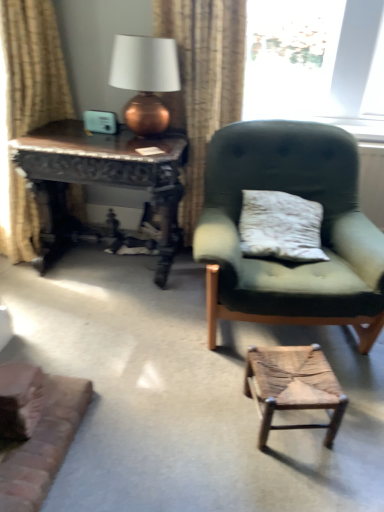
What is the approximate width of green fabric chair at center?

33.68 inches.

Find the location of `beige textured curtain at upper center, acting as the first curtain starting from the right`. beige textured curtain at upper center, acting as the first curtain starting from the right is located at coordinates (203, 81).

This screenshot has height=512, width=384. What do you see at coordinates (145, 79) in the screenshot?
I see `copper metallic table lamp at upper left` at bounding box center [145, 79].

The image size is (384, 512). Describe the element at coordinates (33, 66) in the screenshot. I see `beige fabric curtain at left, the first curtain when ordered from left to right` at that location.

This screenshot has width=384, height=512. What do you see at coordinates (293, 386) in the screenshot? I see `rustic wood stool at lower center` at bounding box center [293, 386].

Where is `green fabric chair at center`? The height and width of the screenshot is (512, 384). green fabric chair at center is located at coordinates coord(321,230).

Can you confirm if rustic wood stool at lower center is shorter than beige fabric curtain at left, positioned as the 2th curtain in right-to-left order?

Yes, rustic wood stool at lower center is shorter than beige fabric curtain at left, positioned as the 2th curtain in right-to-left order.

Are rustic wood stool at lower center and beige fabric curtain at left, the first curtain when ordered from left to right, far apart?

Yes, rustic wood stool at lower center is far from beige fabric curtain at left, the first curtain when ordered from left to right.

Which object is closer to the camera taking this photo, rustic wood stool at lower center or beige fabric curtain at left, the first curtain when ordered from left to right?

rustic wood stool at lower center is more forward.

From the picture: Who is smaller, rustic wood stool at lower center or beige fabric curtain at left, the first curtain when ordered from left to right?

rustic wood stool at lower center is smaller.

Which point is more distant from viewer, (190, 150) or (154, 41)?

The point (190, 150) is farther.

Is beige textured curtain at upper center, which is the 2th curtain from left to right, bigger or smaller than copper metallic table lamp at upper left?

Clearly, beige textured curtain at upper center, which is the 2th curtain from left to right, is larger in size than copper metallic table lamp at upper left.

Does beige textured curtain at upper center, which is the 2th curtain from left to right, have a lesser width compared to copper metallic table lamp at upper left?

Indeed, beige textured curtain at upper center, which is the 2th curtain from left to right, has a lesser width compared to copper metallic table lamp at upper left.

From the image's perspective, is beige textured curtain at upper center, which is the 2th curtain from left to right, on top of copper metallic table lamp at upper left?

Incorrect, from the image's perspective, beige textured curtain at upper center, which is the 2th curtain from left to right, is lower than copper metallic table lamp at upper left.

Looking at this image, between green fabric chair at center and wooden carved table at left, which one is positioned in front?

green fabric chair at center is closer to the camera.

Which point is more forward, (294, 148) or (77, 157)?

The point (77, 157) is in front.

Is green fabric chair at center oriented towards wooden carved table at left?

No, green fabric chair at center is not facing towards wooden carved table at left.

Would you consider green fabric chair at center to be distant from wooden carved table at left?

That's not correct — green fabric chair at center is a little close to wooden carved table at left.

How different are the orientations of beige fabric curtain at left, positioned as the 2th curtain in right-to-left order, and rustic wood stool at lower center in degrees?

There is a 76.6-degree angle between the facing directions of beige fabric curtain at left, positioned as the 2th curtain in right-to-left order, and rustic wood stool at lower center.

From the picture: Is beige fabric curtain at left, positioned as the 2th curtain in right-to-left order, at the right side of rustic wood stool at lower center?

No.

Considering their positions, is beige fabric curtain at left, positioned as the 2th curtain in right-to-left order, located in front of or behind rustic wood stool at lower center?

Visually, beige fabric curtain at left, positioned as the 2th curtain in right-to-left order, is located behind rustic wood stool at lower center.

Which point is more distant from viewer, (17, 219) or (318, 424)?

Positioned behind is point (17, 219).

Which is more to the right, copper metallic table lamp at upper left or green fabric chair at center?

From the viewer's perspective, green fabric chair at center appears more on the right side.

Is copper metallic table lamp at upper left beside green fabric chair at center?

No, copper metallic table lamp at upper left is not beside green fabric chair at center.

Who is more distant, copper metallic table lamp at upper left or green fabric chair at center?

copper metallic table lamp at upper left.

From a real-world perspective, is copper metallic table lamp at upper left above or below green fabric chair at center?

Clearly, from a real-world perspective, copper metallic table lamp at upper left is above green fabric chair at center.

Does rustic wood stool at lower center have a lesser width compared to wooden carved table at left?

Correct, the width of rustic wood stool at lower center is less than that of wooden carved table at left.

In terms of height, does rustic wood stool at lower center look taller or shorter compared to wooden carved table at left?

Clearly, rustic wood stool at lower center is shorter compared to wooden carved table at left.

From a real-world perspective, is rustic wood stool at lower center physically above wooden carved table at left?

No, from a real-world perspective, rustic wood stool at lower center is not above wooden carved table at left.

Does rustic wood stool at lower center contain wooden carved table at left?

No, wooden carved table at left is located outside of rustic wood stool at lower center.

Is beige fabric curtain at left, the first curtain when ordered from left to right, next to beige textured curtain at upper center, acting as the first curtain starting from the right?

No, beige fabric curtain at left, the first curtain when ordered from left to right, is not touching beige textured curtain at upper center, acting as the first curtain starting from the right.

Could you tell me if beige fabric curtain at left, positioned as the 2th curtain in right-to-left order, is facing beige textured curtain at upper center, which is the 2th curtain from left to right?

Yes, beige fabric curtain at left, positioned as the 2th curtain in right-to-left order, is facing beige textured curtain at upper center, which is the 2th curtain from left to right.

Between beige fabric curtain at left, the first curtain when ordered from left to right, and beige textured curtain at upper center, which is the 2th curtain from left to right, which one has larger size?

beige fabric curtain at left, the first curtain when ordered from left to right.

Find the location of a particular element. The width and height of the screenshot is (384, 512). curtain behind the beige fabric curtain at left, the first curtain when ordered from left to right is located at coordinates (203, 81).

Find the location of a particular element. The height and width of the screenshot is (512, 384). stool that appears on the right of beige fabric curtain at left, positioned as the 2th curtain in right-to-left order is located at coordinates (293, 386).

Where is `curtain behind the copper metallic table lamp at upper left`? curtain behind the copper metallic table lamp at upper left is located at coordinates (203, 81).

From the image, which object appears to be farther from beige textured curtain at upper center, which is the 2th curtain from left to right, wooden carved table at left or beige fabric curtain at left, the first curtain when ordered from left to right?

beige fabric curtain at left, the first curtain when ordered from left to right, is further to beige textured curtain at upper center, which is the 2th curtain from left to right.

When comparing their distances from beige textured curtain at upper center, acting as the first curtain starting from the right, does rustic wood stool at lower center or copper metallic table lamp at upper left seem further?

Based on the image, rustic wood stool at lower center appears to be further to beige textured curtain at upper center, acting as the first curtain starting from the right.

Considering their positions, is beige textured curtain at upper center, acting as the first curtain starting from the right, positioned closer to wooden carved table at left than beige fabric curtain at left, positioned as the 2th curtain in right-to-left order?

beige fabric curtain at left, positioned as the 2th curtain in right-to-left order, is positioned closer to the anchor wooden carved table at left.

Considering their positions, is wooden carved table at left positioned closer to beige textured curtain at upper center, which is the 2th curtain from left to right, than green fabric chair at center?

wooden carved table at left.

Considering their positions, is beige textured curtain at upper center, which is the 2th curtain from left to right, positioned further to copper metallic table lamp at upper left than wooden carved table at left?

wooden carved table at left is further to copper metallic table lamp at upper left.

Based on their spatial positions, is beige fabric curtain at left, the first curtain when ordered from left to right, or wooden carved table at left further from green fabric chair at center?

Based on the image, beige fabric curtain at left, the first curtain when ordered from left to right, appears to be further to green fabric chair at center.

When comparing their distances from beige fabric curtain at left, the first curtain when ordered from left to right, does beige textured curtain at upper center, acting as the first curtain starting from the right, or green fabric chair at center seem closer?

beige textured curtain at upper center, acting as the first curtain starting from the right, lies closer to beige fabric curtain at left, the first curtain when ordered from left to right, than the other object.

Looking at this image, considering their positions, is rustic wood stool at lower center positioned further to beige fabric curtain at left, positioned as the 2th curtain in right-to-left order, than copper metallic table lamp at upper left?

The object further to beige fabric curtain at left, positioned as the 2th curtain in right-to-left order, is rustic wood stool at lower center.

You are a GUI agent. You are given a task and a screenshot of the screen. Output one action in this format:
    pyautogui.click(x=<x>, y=<y>)
    Task: Click on the table lamp between beige fabric curtain at left, the first curtain when ordered from left to right, and beige textured curtain at upper center, which is the 2th curtain from left to right
    
    Given the screenshot: What is the action you would take?
    pyautogui.click(x=145, y=79)

In order to click on table lamp located between wooden carved table at left and green fabric chair at center in the left-right direction in this screenshot , I will do `click(145, 79)`.

I want to click on nightstand between beige fabric curtain at left, positioned as the 2th curtain in right-to-left order, and rustic wood stool at lower center, in the horizontal direction, so click(x=102, y=176).

Find the location of a particular element. The height and width of the screenshot is (512, 384). stool located between wooden carved table at left and green fabric chair at center in the left-right direction is located at coordinates (293, 386).